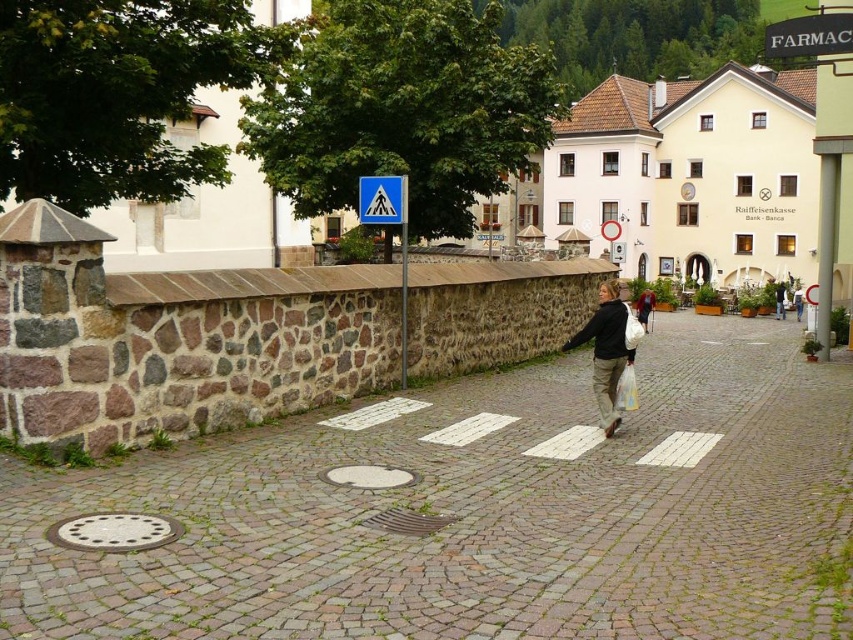
You are a tourist on the cobblestone pavement and want to reach the sign. Which direction should you move to go from the brown cobblestone pavement at center to the black plastic sign at upper right?

The brown cobblestone pavement at center is to the left of the black plastic sign at upper right, so you should move to the right to reach it.

You are a pedestrian standing on the cobblestone walkway. You notice the matte black jacket at center and the blue plastic pedestrian sign at upper center. Which object is taller?

The blue plastic pedestrian sign at upper center is taller than the matte black jacket at center.